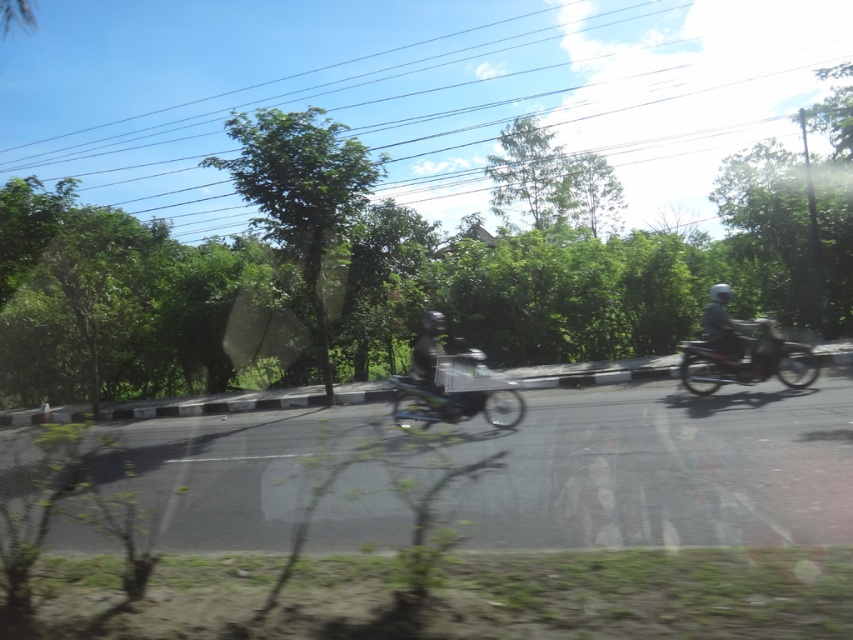
Between metallic silver motorcycle at right and metallic silver bicycle at center, which one appears on the right side from the viewer's perspective?

metallic silver motorcycle at right is more to the right.

Between metallic silver motorcycle at right and metallic silver bicycle at center, which one appears on the left side from the viewer's perspective?

From the viewer's perspective, metallic silver bicycle at center appears more on the left side.

The image size is (853, 640). In order to click on metallic silver motorcycle at right in this screenshot , I will do `click(741, 352)`.

Where is `metallic silver motorcycle at right`? This screenshot has height=640, width=853. metallic silver motorcycle at right is located at coordinates (741, 352).